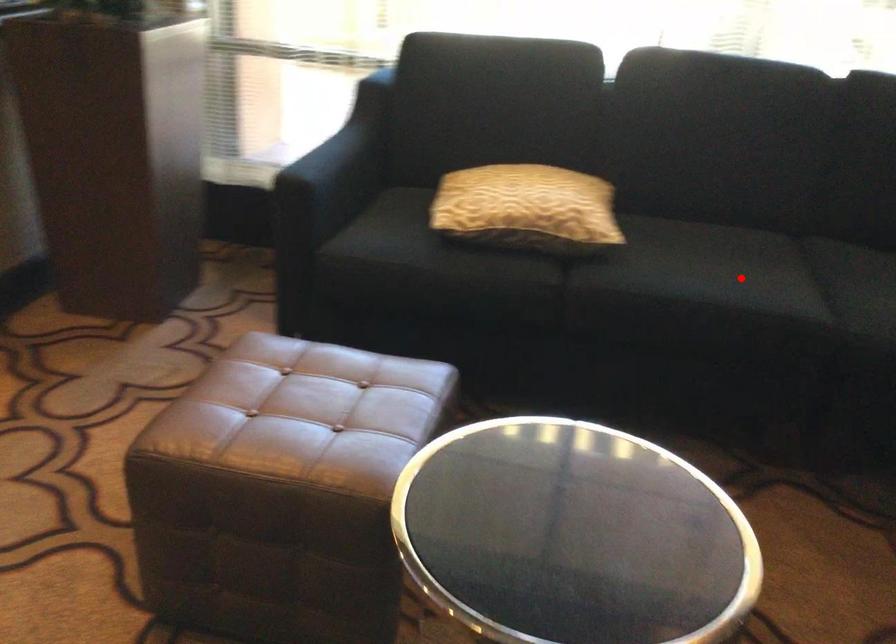
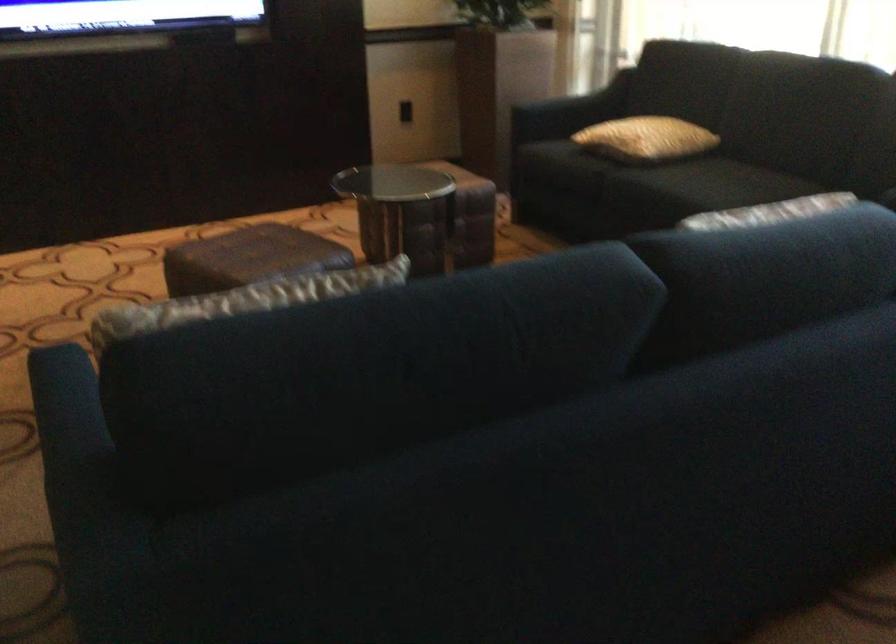
Find the pixel in the second image that matches the highlighted location in the first image.

(709, 184)